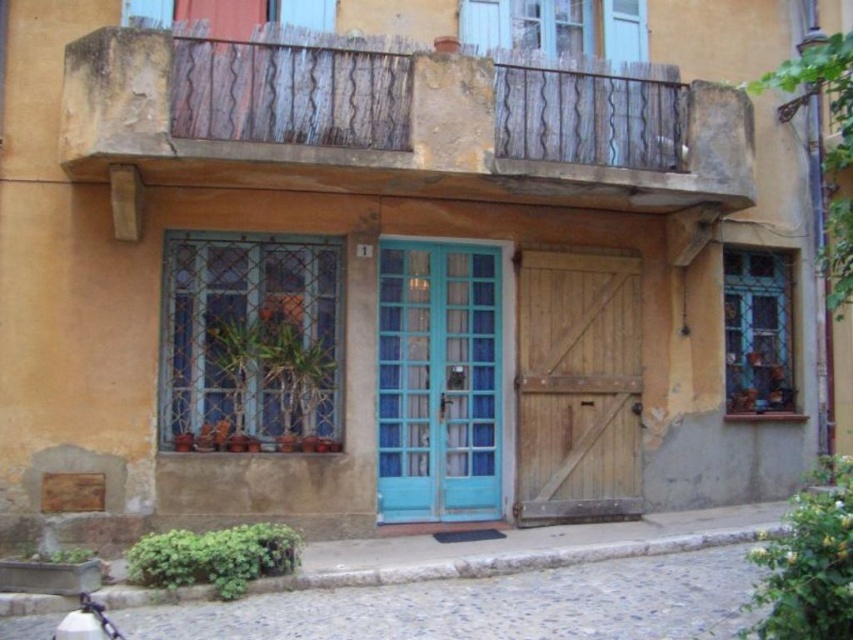
The height and width of the screenshot is (640, 853). In order to click on weathered wood at upper center in this screenshot , I will do `click(380, 150)`.

Does weathered wood at upper center have a lesser width compared to wooden plank door at center?

Yes.

Where is `weathered wood at upper center`? weathered wood at upper center is located at coordinates (380, 150).

The image size is (853, 640). Identify the location of weathered wood at upper center. (380, 150).

Does teal glass door at center have a lesser height compared to wooden plank door at center?

No, teal glass door at center is not shorter than wooden plank door at center.

Does teal glass door at center appear over wooden plank door at center?

Yes.

Locate an element on the screen. Image resolution: width=853 pixels, height=640 pixels. teal glass door at center is located at coordinates (438, 381).

The height and width of the screenshot is (640, 853). Identify the location of teal glass door at center. (438, 381).

Which is more to the left, weathered wood at upper center or teal glass door at center?

From the viewer's perspective, weathered wood at upper center appears more on the left side.

Is weathered wood at upper center to the left of teal glass door at center from the viewer's perspective?

Yes, weathered wood at upper center is to the left of teal glass door at center.

Which is behind, point (140, 106) or point (390, 449)?

Point (390, 449)

The width and height of the screenshot is (853, 640). Find the location of `weathered wood at upper center`. weathered wood at upper center is located at coordinates [x=380, y=150].